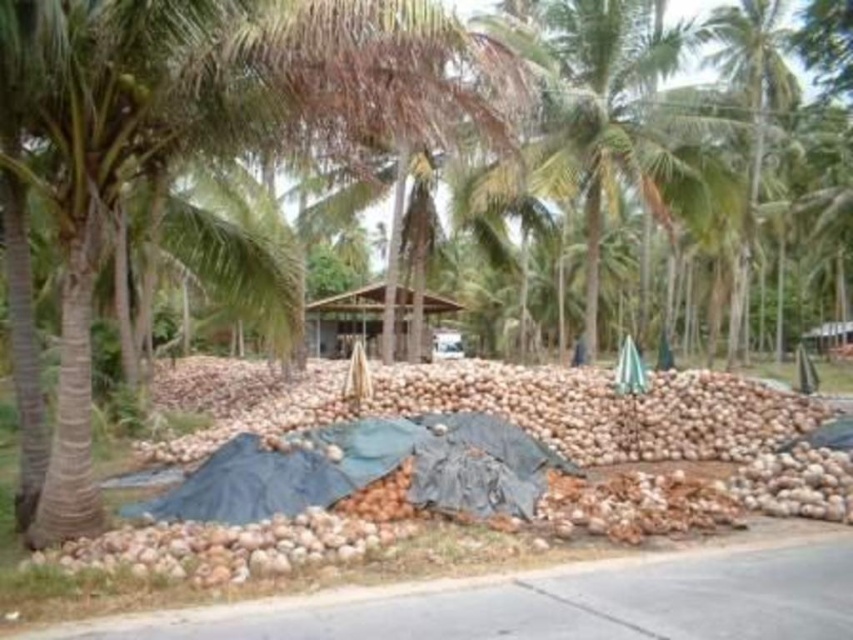
Does green leafy palm tree at center have a larger size compared to green leafy palm tree at upper right?

Incorrect, green leafy palm tree at center is not larger than green leafy palm tree at upper right.

Which is in front, point (532, 152) or point (746, 4)?

Positioned in front is point (532, 152).

I want to click on green leafy palm tree at center, so click(602, 109).

Is green leafy palm tree at upper right to the right of brown wooden hut at center from the viewer's perspective?

Correct, you'll find green leafy palm tree at upper right to the right of brown wooden hut at center.

Is green leafy palm tree at upper right taller than brown wooden hut at center?

Correct, green leafy palm tree at upper right is much taller as brown wooden hut at center.

Is point (741, 33) behind point (397, 310)?

Yes, it is behind point (397, 310).

This screenshot has height=640, width=853. Identify the location of green leafy palm tree at upper right. (751, 115).

Which is below, green leafy palm tree at center or brown wooden hut at center?

Positioned lower is brown wooden hut at center.

Is point (659, 196) positioned behind point (358, 291)?

No, it is in front of (358, 291).

Locate an element on the screen. Image resolution: width=853 pixels, height=640 pixels. green leafy palm tree at center is located at coordinates (602, 109).